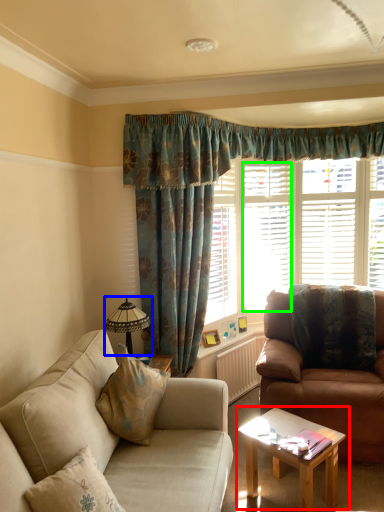
Question: Which object is positioned farthest from coffee table (highlighted by a red box)? Select from lamp (highlighted by a blue box) and shutter (highlighted by a green box).

Choices:
 (A) lamp
 (B) shutter

Answer: (B)